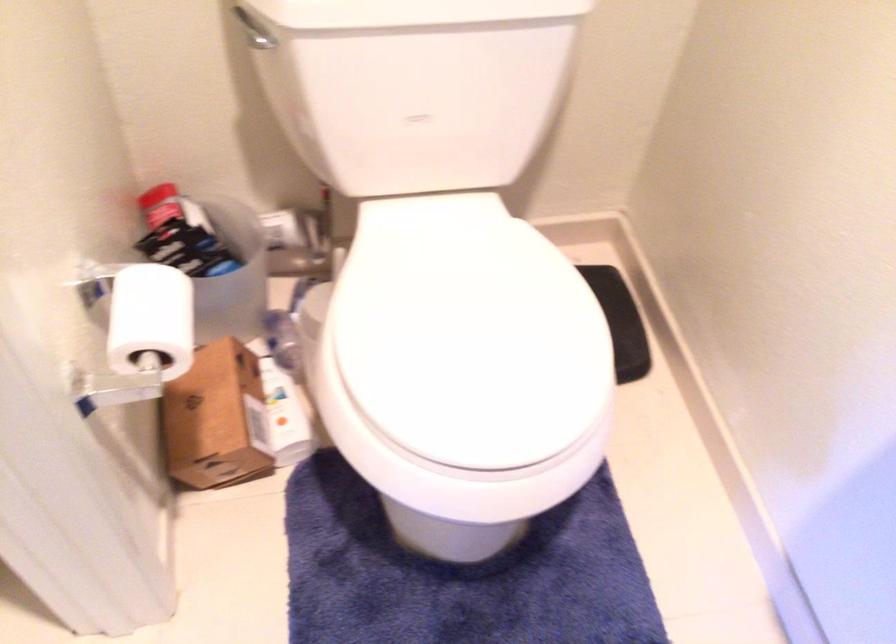
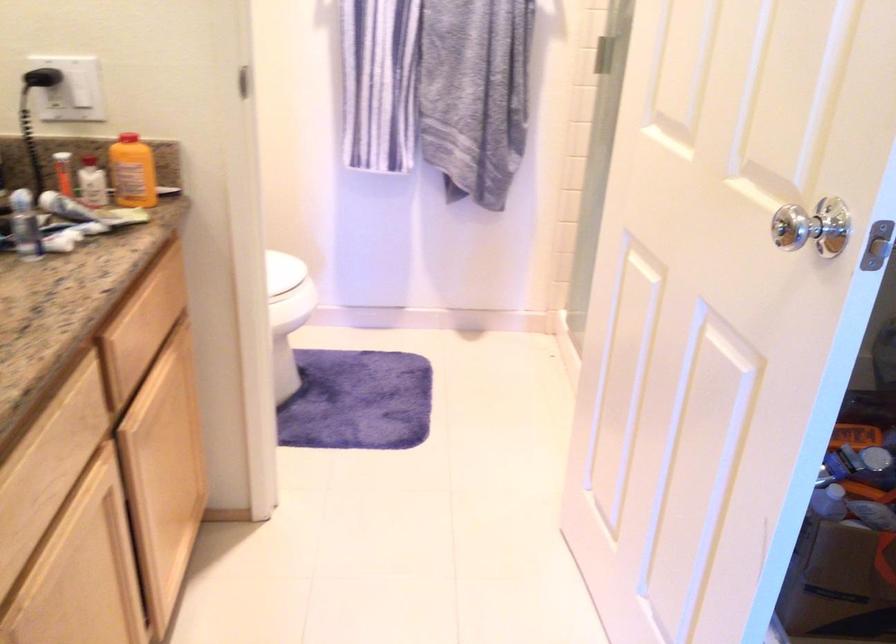
Where in the second image is the point corresponding to point (483, 413) from the first image?

(282, 270)